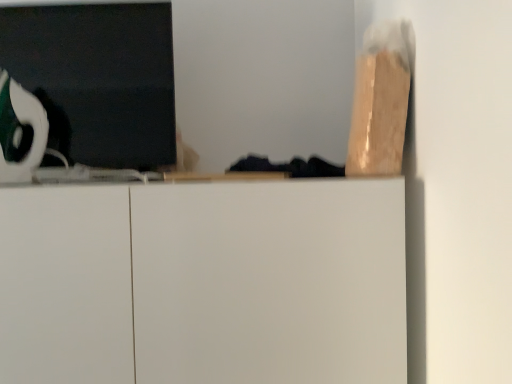
Locate an element on the screen. matte black monitor at upper left is located at coordinates (100, 76).

This screenshot has height=384, width=512. Describe the element at coordinates (100, 76) in the screenshot. I see `matte black monitor at upper left` at that location.

Locate an element on the screen. matte black monitor at upper left is located at coordinates (100, 76).